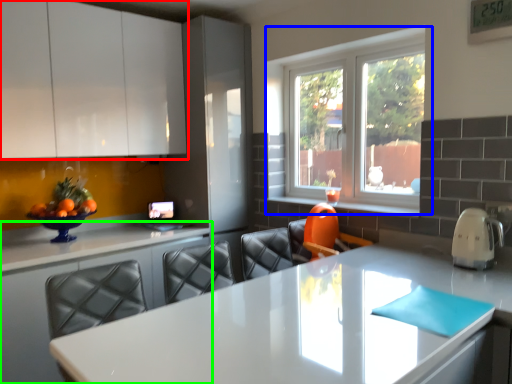
Question: Based on their relative distances, which object is nearer to cabinetry (highlighted by a red box)? Choose from window (highlighted by a blue box) and countertop (highlighted by a green box).

Choices:
 (A) window
 (B) countertop

Answer: (B)